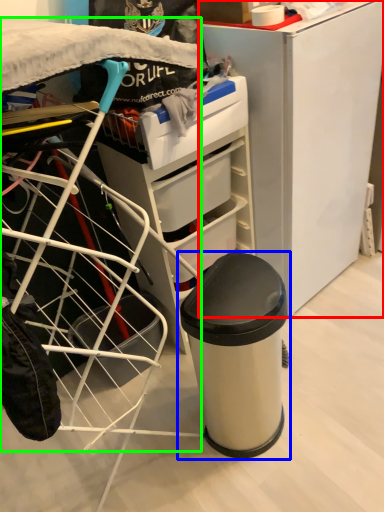
Question: Estimate the real-world distances between objects in this image. Which object is farther from furniture (highlighted by a red box), waste container (highlighted by a blue box) or wide (highlighted by a green box)?

Choices:
 (A) waste container
 (B) wide

Answer: (B)